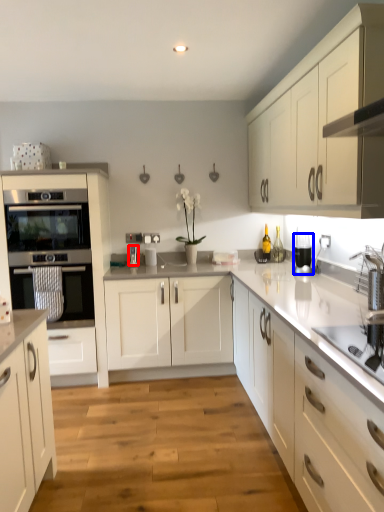
Question: Which point is closer to the camera, appliance (highlighted by a red box) or kitchen appliance (highlighted by a blue box)?

Choices:
 (A) appliance
 (B) kitchen appliance

Answer: (B)